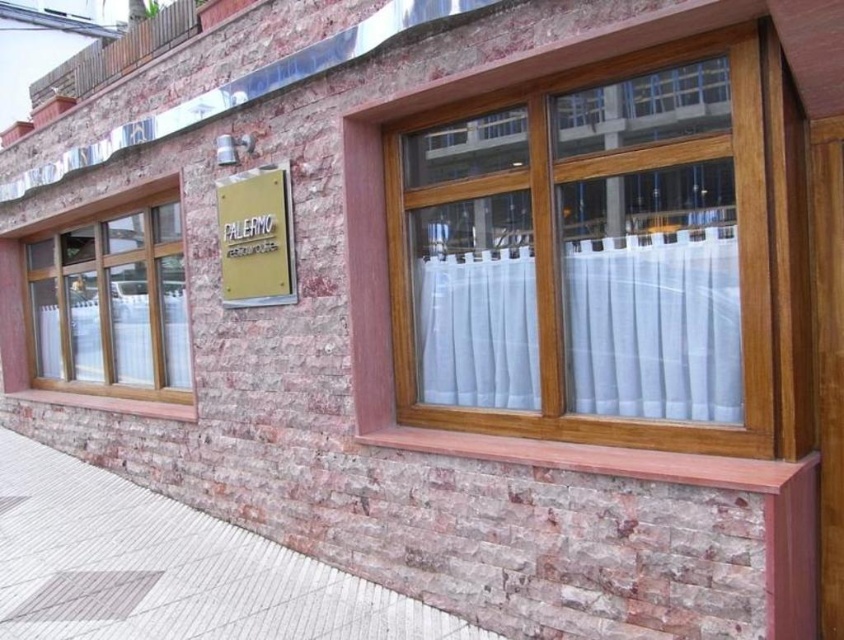
Between point (396, 608) and point (169, 243), which one is positioned behind?

Point (169, 243)

Image resolution: width=844 pixels, height=640 pixels. I want to click on white concrete pavement at lower left, so click(x=169, y=566).

Is point (412, 621) in front of point (133, 244)?

Yes, it is.

Image resolution: width=844 pixels, height=640 pixels. I want to click on white concrete pavement at lower left, so click(x=169, y=566).

Who is lower down, wooden frame at upper center or white sheer curtain at center?

white sheer curtain at center is below.

This screenshot has width=844, height=640. What are the coordinates of `wooden frame at upper center` in the screenshot? It's located at (591, 257).

Where is `wooden frame at upper center`? wooden frame at upper center is located at coordinates coord(591,257).

I want to click on wooden frame at upper center, so click(x=591, y=257).

Can you confirm if wooden frame at upper center is wider than white concrete pavement at lower left?

No.

Based on the photo, which is more to the right, wooden frame at upper center or white concrete pavement at lower left?

Positioned to the right is wooden frame at upper center.

In the scene shown: Who is more distant from viewer, (461,116) or (165,561)?

The point (165,561) is more distant.

Image resolution: width=844 pixels, height=640 pixels. Identify the location of wooden frame at upper center. (591, 257).